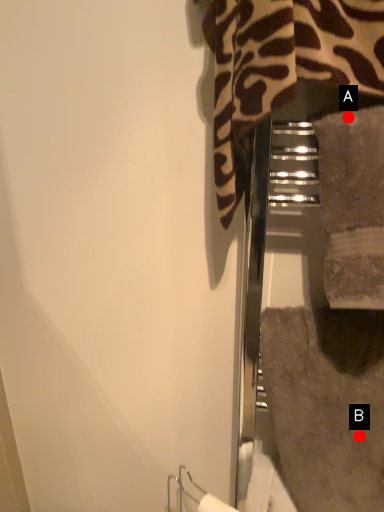
Question: Two points are circled on the image, labeled by A and B beside each circle. Which point appears farthest from the camera in this image?

Choices:
 (A) A is further
 (B) B is further

Answer: (B)